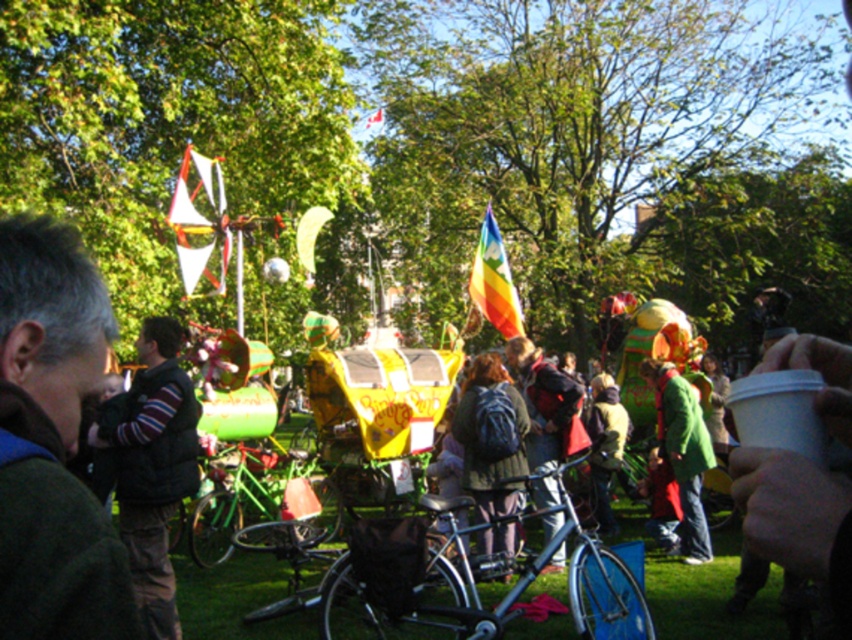
Between green grass at lower center and shiny metallic bicycle at center, which one appears on the right side from the viewer's perspective?

green grass at lower center is more to the right.

Between point (688, 628) and point (363, 584), which one is positioned in front?

Point (363, 584) is in front.

Describe the element at coordinates (707, 595) in the screenshot. The height and width of the screenshot is (640, 852). I see `green grass at lower center` at that location.

Locate an element on the screen. green grass at lower center is located at coordinates (707, 595).

Does shiny metallic bicycle at center have a lesser height compared to white fabric flag at upper left?

Correct, shiny metallic bicycle at center is not as tall as white fabric flag at upper left.

Is shiny metallic bicycle at center positioned before white fabric flag at upper left?

Yes, it is in front of white fabric flag at upper left.

Locate an element on the screen. shiny metallic bicycle at center is located at coordinates (478, 593).

Can you confirm if matte green backpack at center is taller than white fabric flag at upper left?

No, matte green backpack at center is not taller than white fabric flag at upper left.

Can you confirm if matte green backpack at center is thinner than white fabric flag at upper left?

Correct, matte green backpack at center's width is less than white fabric flag at upper left's.

Image resolution: width=852 pixels, height=640 pixels. Describe the element at coordinates (491, 436) in the screenshot. I see `matte green backpack at center` at that location.

Image resolution: width=852 pixels, height=640 pixels. In order to click on matte green backpack at center in this screenshot , I will do (x=491, y=436).